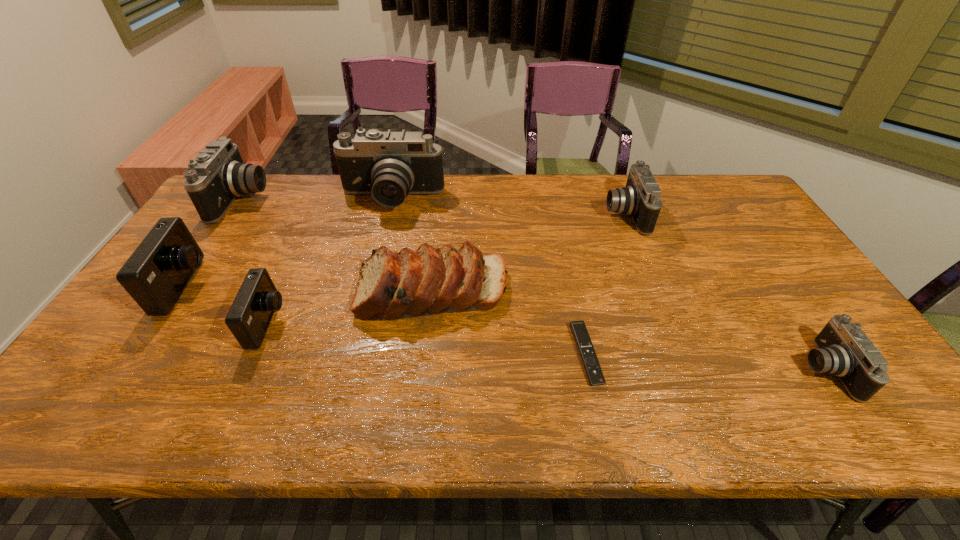
The width and height of the screenshot is (960, 540). In order to click on free point that satisfies the following two spatial constraints: 1. on the front-facing side of the third camera from right to left; 2. on the right side of the remote control in this screenshot , I will do `click(353, 354)`.

The height and width of the screenshot is (540, 960). Find the location of `free location that satisfies the following two spatial constraints: 1. on the front-facing side of the fourth camera from left to right; 2. on the left side of the bread`. free location that satisfies the following two spatial constraints: 1. on the front-facing side of the fourth camera from left to right; 2. on the left side of the bread is located at coordinates (370, 290).

You are a GUI agent. You are given a task and a screenshot of the screen. Output one action in this format:
    pyautogui.click(x=<x>, y=<y>)
    Task: Click on the vacant region that satisfies the following two spatial constraints: 1. on the front-facing side of the third black camera from right to left; 2. on the right side of the bread
    
    Given the screenshot: What is the action you would take?
    pyautogui.click(x=370, y=290)